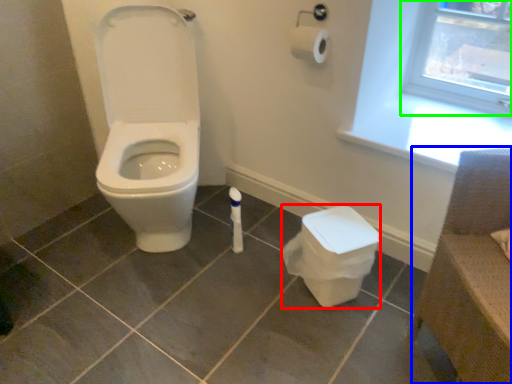
Question: Estimate the real-world distances between objects in this image. Which object is farther from potty (highlighted by a red box), chair (highlighted by a blue box) or window frame (highlighted by a green box)?

Choices:
 (A) chair
 (B) window frame

Answer: (B)